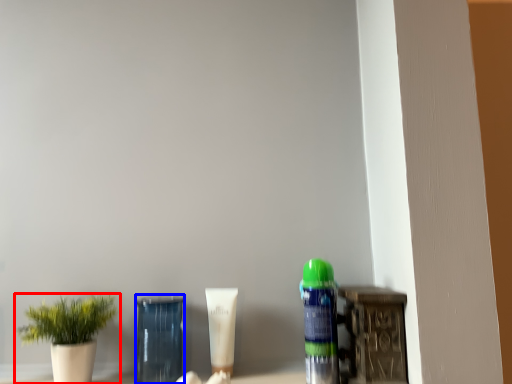
Question: Among these objects, which one is farthest to the camera, houseplant (highlighted by a red box) or glass vase (highlighted by a blue box)?

Choices:
 (A) houseplant
 (B) glass vase

Answer: (B)